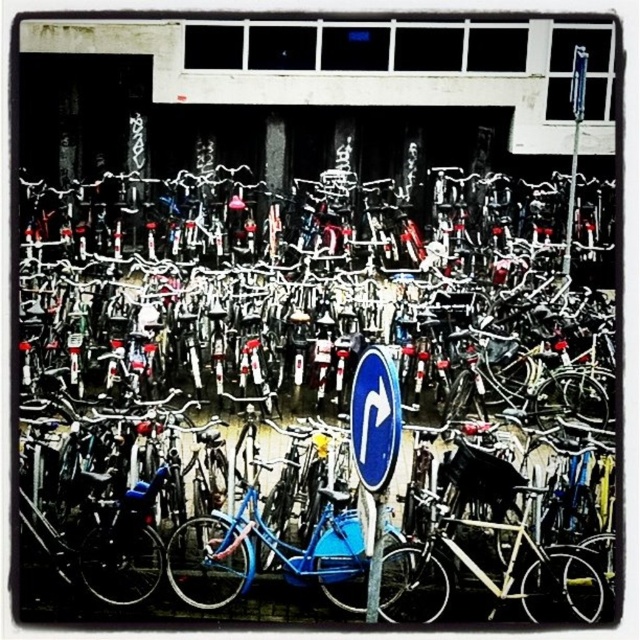
Question: Does blue matte bicycle at center come behind blue plastic street sign at center?

Choices:
 (A) no
 (B) yes

Answer: (B)

Question: Does blue matte bicycle at center appear on the right side of blue plastic street sign at center?

Choices:
 (A) no
 (B) yes

Answer: (B)

Question: Which point is closer to the camera taking this photo?

Choices:
 (A) (385, 344)
 (B) (360, 476)

Answer: (B)

Question: Considering the relative positions of blue matte bicycle at center and blue plastic street sign at center in the image provided, where is blue matte bicycle at center located with respect to blue plastic street sign at center?

Choices:
 (A) below
 (B) above

Answer: (B)

Question: Which point appears farthest from the camera in this image?

Choices:
 (A) (397, 428)
 (B) (435, 522)

Answer: (B)